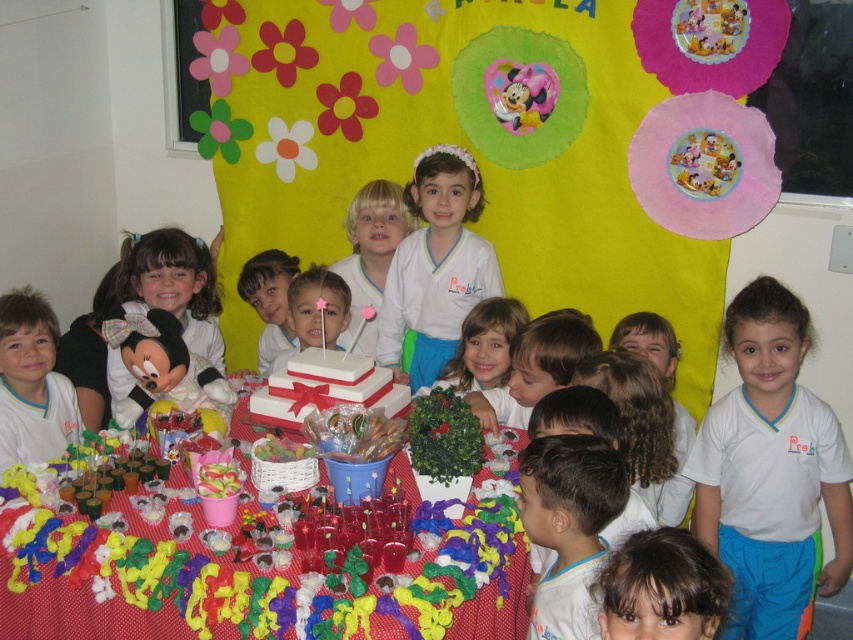
Which of these two, white cotton shirt at center or white matte shirt at center, stands shorter?

white matte shirt at center is shorter.

Can you confirm if white cotton shirt at center is positioned to the right of white matte shirt at center?

Correct, you'll find white cotton shirt at center to the right of white matte shirt at center.

This screenshot has width=853, height=640. Describe the element at coordinates (770, 472) in the screenshot. I see `white cotton shirt at center` at that location.

Identify the location of white cotton shirt at center. Image resolution: width=853 pixels, height=640 pixels. (770, 472).

Does brown hair at lower center have a greater width compared to white plush minnie mouse at left?

No.

Which is in front, point (639, 634) or point (186, 317)?

Point (639, 634)

You are a GUI agent. You are given a task and a screenshot of the screen. Output one action in this format:
    pyautogui.click(x=<x>, y=<y>)
    Task: Click on the brown hair at lower center
    
    Given the screenshot: What is the action you would take?
    pyautogui.click(x=660, y=588)

Which is more to the left, white matte shirt at center or white cotton shirt at lower right?

white matte shirt at center

Measure the distance between white matte shirt at center and camera.

A distance of 9.23 feet exists between white matte shirt at center and camera.

Identify the location of white matte shirt at center. (434, 268).